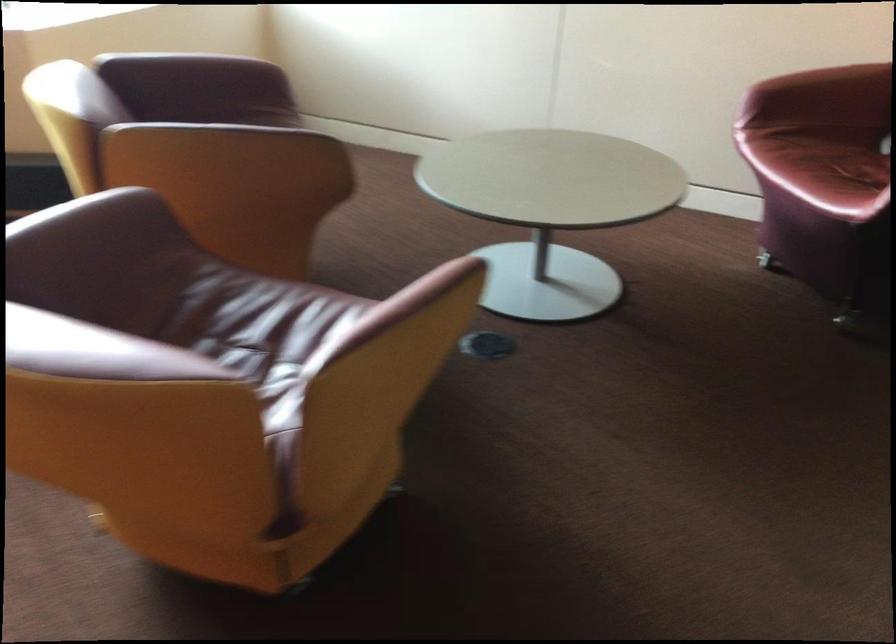
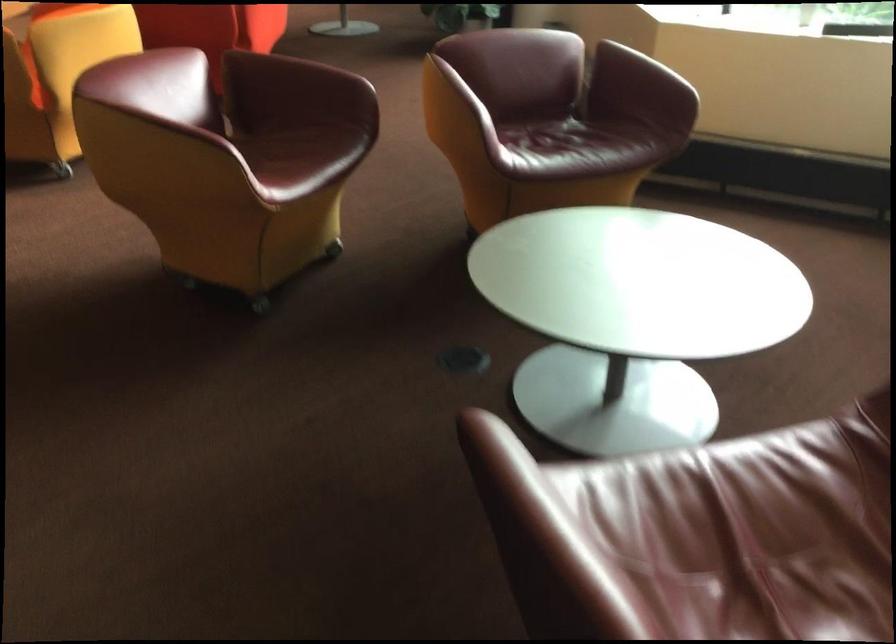
Locate, in the second image, the point that corresponds to [260,136] in the first image.

(463, 91)